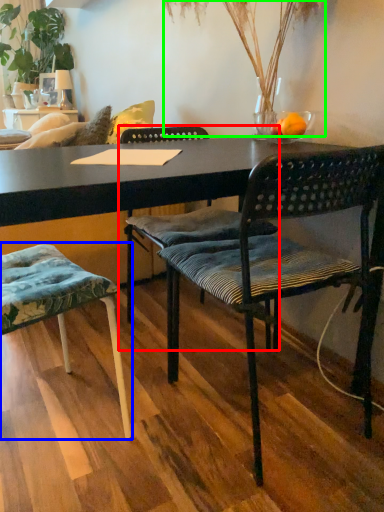
Question: Based on their relative distances, which object is farther from chair (highlighted by a red box)? Choose from chair (highlighted by a blue box) and plant (highlighted by a green box).

Choices:
 (A) chair
 (B) plant

Answer: (B)